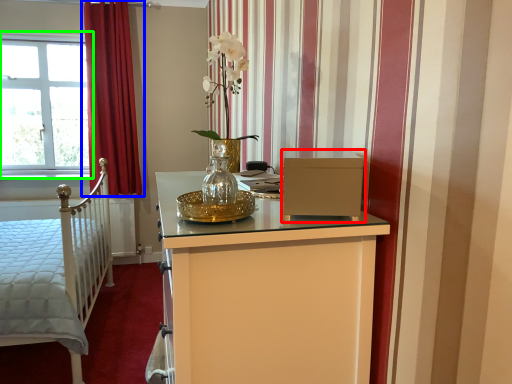
Question: Based on their relative distances, which object is farther from file cabinet (highlighted by a red box)? Choose from curtain (highlighted by a blue box) and window (highlighted by a green box).

Choices:
 (A) curtain
 (B) window

Answer: (B)